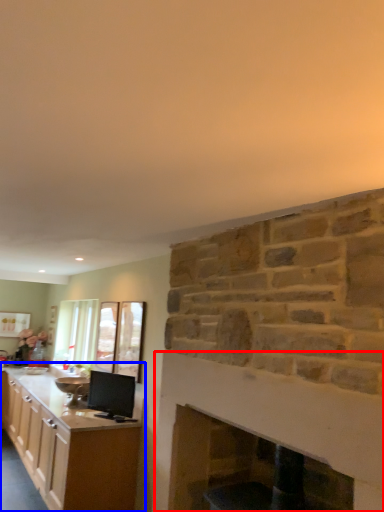
Question: Which point is closer to the camera, fireplace (highlighted by a red box) or cabinetry (highlighted by a blue box)?

Choices:
 (A) fireplace
 (B) cabinetry

Answer: (A)